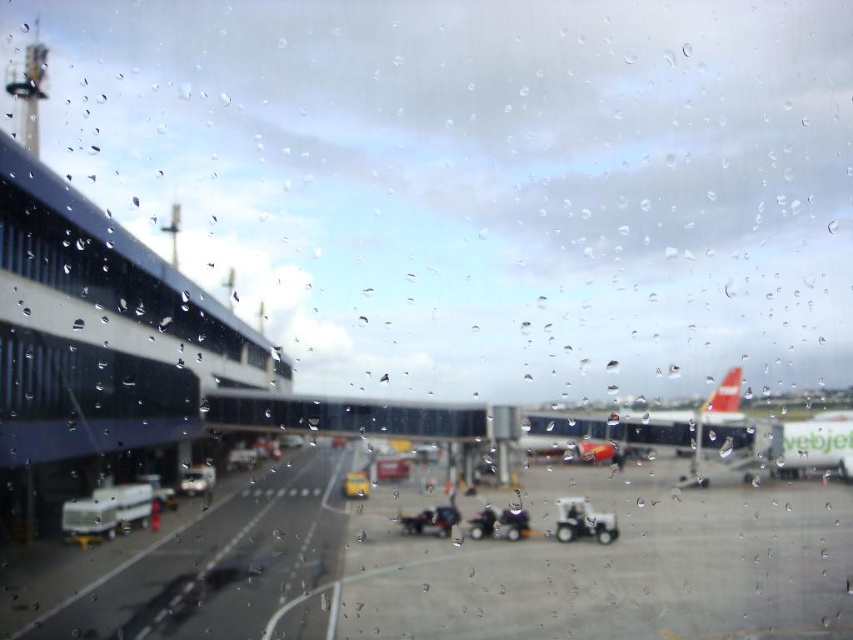
Can you confirm if metallic silver cart at center is bigger than metallic silver car at lower left?

Correct, metallic silver cart at center is larger in size than metallic silver car at lower left.

What do you see at coordinates (498, 522) in the screenshot? The height and width of the screenshot is (640, 853). I see `metallic silver cart at center` at bounding box center [498, 522].

Locate an element on the screen. The image size is (853, 640). metallic silver cart at center is located at coordinates (498, 522).

Identify the location of metallic silver cart at center. This screenshot has height=640, width=853. (498, 522).

Is white rubber airport runway at lower center below metallic silver cart at center?

Correct, white rubber airport runway at lower center is located below metallic silver cart at center.

Does point (196, 608) lie in front of point (485, 525)?

Yes, point (196, 608) is in front of point (485, 525).

Who is more forward, (134, 636) or (492, 508)?

Point (134, 636) is in front.

Identify the location of white rubber airport runway at lower center. (218, 564).

Does metallic silver car at center have a smaller size compared to metallic silver car at lower left?

No, metallic silver car at center is not smaller than metallic silver car at lower left.

Is point (425, 520) more distant than point (181, 481)?

No, it is in front of (181, 481).

You are a GUI agent. You are given a task and a screenshot of the screen. Output one action in this format:
    pyautogui.click(x=<x>, y=<y>)
    Task: Click on the metallic silver car at center
    
    Given the screenshot: What is the action you would take?
    pyautogui.click(x=431, y=520)